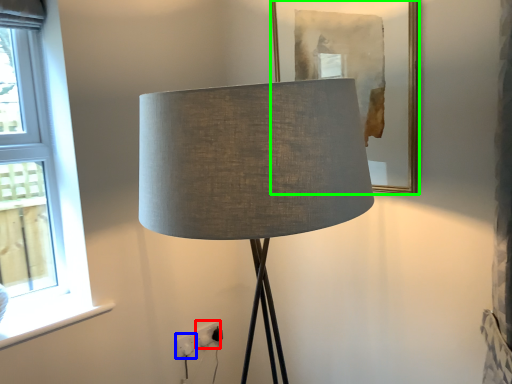
Question: Which is nearer to the electric outlet (highlighted by a red box)? electric outlet (highlighted by a blue box) or picture frame (highlighted by a green box).

Choices:
 (A) electric outlet
 (B) picture frame

Answer: (A)